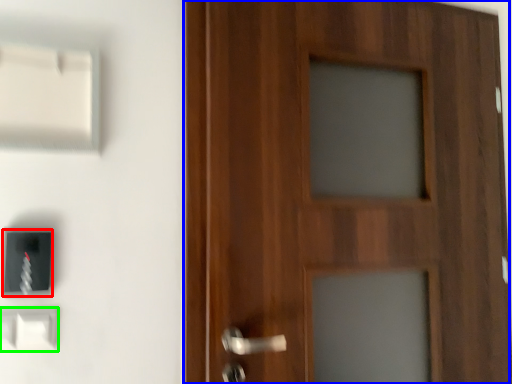
Question: Estimate the real-world distances between objects in this image. Which object is farther from light switch (highlighted by a red box), door (highlighted by a blue box) or light switch (highlighted by a green box)?

Choices:
 (A) door
 (B) light switch

Answer: (A)